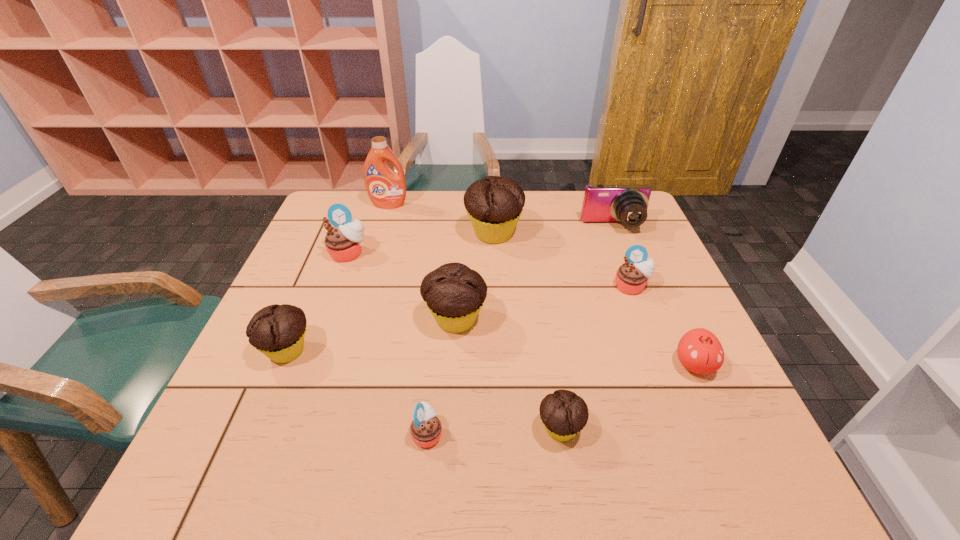
Identify the location of free space located 0.160m on the front of the leftmost chocolate muffin. Image resolution: width=960 pixels, height=540 pixels. (248, 443).

Identify the location of vacant area situated on the left of the apple. (507, 365).

Locate an element on the screen. free region located 0.300m on the front-facing side of the nearest pink muffin is located at coordinates (602, 434).

Find the location of a particular element. Image resolution: width=960 pixels, height=540 pixels. vacant space located 0.350m on the left of the nearest chocolate muffin is located at coordinates (352, 429).

At what (x,y) coordinates should I click in order to perform the action: click on detergent that is at the far edge. Please return your answer as a coordinate pair (x, y). This screenshot has height=540, width=960. Looking at the image, I should click on (386, 188).

You are a GUI agent. You are given a task and a screenshot of the screen. Output one action in this format:
    pyautogui.click(x=<x>, y=<y>)
    Task: Click on the muffin located at the far edge
    This screenshot has width=960, height=540.
    Given the screenshot: What is the action you would take?
    pyautogui.click(x=494, y=204)

Where is `camera that is at the far edge`? camera that is at the far edge is located at coordinates (628, 204).

Where is `detergent that is positioned at the left edge`? The width and height of the screenshot is (960, 540). detergent that is positioned at the left edge is located at coordinates (386, 188).

Where is `camera that is at the right edge`? camera that is at the right edge is located at coordinates (628, 204).

Find the location of a particular element. muffin that is at the right edge is located at coordinates (631, 277).